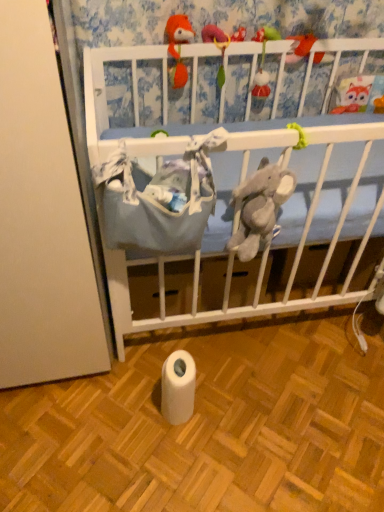
Identify the location of fuzzy fabric toy at upper center, marked as the second toy in a right-to-left arrangement. (263, 65).

The width and height of the screenshot is (384, 512). Find the location of `matte orange plush at upper center, which is the third toy in left-to-right order`. matte orange plush at upper center, which is the third toy in left-to-right order is located at coordinates (300, 47).

Where is `blue fabric crib at upper center`? The image size is (384, 512). blue fabric crib at upper center is located at coordinates point(105,91).

I want to click on white matte toilet paper at lower center, so click(178, 387).

You are a GUI agent. You are given a task and a screenshot of the screen. Output one action in this format:
    pyautogui.click(x=<x>, y=<y>)
    Task: Click on the fuzzy fabric toy at upper center, marked as the second toy in a right-to-left arrangement
    The height and width of the screenshot is (512, 384).
    Given the screenshot: What is the action you would take?
    pyautogui.click(x=263, y=65)

From the image's perspective, is white matte toilet paper at lower center beneath blue fabric crib at upper center?

Correct, white matte toilet paper at lower center appears lower than blue fabric crib at upper center in the image.

Is point (167, 368) in front of point (269, 53)?

Yes, point (167, 368) is in front of point (269, 53).

Is white matte toilet paper at lower center not within blue fabric crib at upper center?

white matte toilet paper at lower center lies outside blue fabric crib at upper center's area.

Consider the image. Is white matte toilet paper at lower center to the left or to the right of blue fabric crib at upper center in the image?

white matte toilet paper at lower center is positioned on blue fabric crib at upper center's left side.

Does matte orange plush at upper center, placed as the 1th toy when sorted from right to left, have a greater width compared to white matte toilet paper at lower center?

In fact, matte orange plush at upper center, placed as the 1th toy when sorted from right to left, might be narrower than white matte toilet paper at lower center.

Find the location of a particular element. toy that is the 3rd object located above the white matte toilet paper at lower center (from the image's perspective) is located at coordinates (300, 47).

Based on their positions, is matte orange plush at upper center, placed as the 1th toy when sorted from right to left, located to the left or right of white matte toilet paper at lower center?

matte orange plush at upper center, placed as the 1th toy when sorted from right to left, is positioned on white matte toilet paper at lower center's right side.

Is matte orange plush at upper center, which is the third toy in left-to-right order, not inside white matte toilet paper at lower center?

Yes, matte orange plush at upper center, which is the third toy in left-to-right order, is not within white matte toilet paper at lower center.

Is matte orange plush at upper center, which is the third toy in left-to-right order, facing away from fuzzy fabric toy at upper center, marked as the second toy in a right-to-left arrangement?

No, matte orange plush at upper center, which is the third toy in left-to-right order,'s orientation is not away from fuzzy fabric toy at upper center, marked as the second toy in a right-to-left arrangement.

Does matte orange plush at upper center, which is the third toy in left-to-right order, have a larger size compared to fuzzy fabric toy at upper center, marked as the second toy in a right-to-left arrangement?

Actually, matte orange plush at upper center, which is the third toy in left-to-right order, might be smaller than fuzzy fabric toy at upper center, marked as the second toy in a right-to-left arrangement.

Between matte orange plush at upper center, placed as the 1th toy when sorted from right to left, and fuzzy fabric toy at upper center, marked as the second toy in a right-to-left arrangement, which one has smaller width?

fuzzy fabric toy at upper center, marked as the second toy in a right-to-left arrangement, is thinner.

Is point (291, 38) closer or farther from the camera than point (270, 90)?

Point (291, 38).

From the image's perspective, is fluffy orange fox at upper center, the 1th toy from the left, below fuzzy fabric toy at upper center, marked as the second toy in a right-to-left arrangement?

Yes, from the image's perspective, fluffy orange fox at upper center, the 1th toy from the left, is beneath fuzzy fabric toy at upper center, marked as the second toy in a right-to-left arrangement.

How distant is fluffy orange fox at upper center, which ranks as the third toy in right-to-left order, from fuzzy fabric toy at upper center, marked as the second toy in a right-to-left arrangement?

fluffy orange fox at upper center, which ranks as the third toy in right-to-left order, is 9.75 inches away from fuzzy fabric toy at upper center, marked as the second toy in a right-to-left arrangement.

Can you confirm if fluffy orange fox at upper center, the 1th toy from the left, is bigger than fuzzy fabric toy at upper center, marked as the second toy in a right-to-left arrangement?

Incorrect, fluffy orange fox at upper center, the 1th toy from the left, is not larger than fuzzy fabric toy at upper center, marked as the second toy in a right-to-left arrangement.

Considering the relative positions of fluffy orange fox at upper center, the 1th toy from the left, and fuzzy fabric toy at upper center, marked as the 2th toy in a left-to-right arrangement, in the image provided, is fluffy orange fox at upper center, the 1th toy from the left, to the left or to the right of fuzzy fabric toy at upper center, marked as the 2th toy in a left-to-right arrangement,?

fluffy orange fox at upper center, the 1th toy from the left, is to the left of fuzzy fabric toy at upper center, marked as the 2th toy in a left-to-right arrangement.

Is fuzzy fabric toy at upper center, marked as the second toy in a right-to-left arrangement, directly adjacent to blue fabric crib at upper center?

fuzzy fabric toy at upper center, marked as the second toy in a right-to-left arrangement, is not next to blue fabric crib at upper center, and they're not touching.

From a real-world perspective, relative to blue fabric crib at upper center, is fuzzy fabric toy at upper center, marked as the 2th toy in a left-to-right arrangement, vertically above or below?

In terms of real-world spatial position, fuzzy fabric toy at upper center, marked as the 2th toy in a left-to-right arrangement, is above blue fabric crib at upper center.

Considering the relative positions of fuzzy fabric toy at upper center, marked as the 2th toy in a left-to-right arrangement, and blue fabric crib at upper center in the image provided, is fuzzy fabric toy at upper center, marked as the 2th toy in a left-to-right arrangement, to the left or to the right of blue fabric crib at upper center?

In the image, fuzzy fabric toy at upper center, marked as the 2th toy in a left-to-right arrangement, appears on the right side of blue fabric crib at upper center.

Could you tell me if fuzzy fabric toy at upper center, marked as the 2th toy in a left-to-right arrangement, is turned towards blue fabric crib at upper center?

No, fuzzy fabric toy at upper center, marked as the 2th toy in a left-to-right arrangement, is not oriented towards blue fabric crib at upper center.

Would you say matte orange plush at upper center, which is the third toy in left-to-right order, is to the left or to the right of blue fabric crib at upper center in the picture?

matte orange plush at upper center, which is the third toy in left-to-right order, is positioned on blue fabric crib at upper center's right side.

Considering the points (298, 48) and (248, 42), which point is behind, point (298, 48) or point (248, 42)?

The point (298, 48) is farther from the camera.

Considering the relative sizes of matte orange plush at upper center, which is the third toy in left-to-right order, and blue fabric crib at upper center in the image provided, is matte orange plush at upper center, which is the third toy in left-to-right order, smaller than blue fabric crib at upper center?

Indeed, matte orange plush at upper center, which is the third toy in left-to-right order, has a smaller size compared to blue fabric crib at upper center.

Is matte orange plush at upper center, placed as the 1th toy when sorted from right to left, oriented away from blue fabric crib at upper center?

Correct, matte orange plush at upper center, placed as the 1th toy when sorted from right to left, is looking away from blue fabric crib at upper center.

Can you confirm if fuzzy fabric toy at upper center, marked as the 2th toy in a left-to-right arrangement, is taller than white matte toilet paper at lower center?

Indeed, fuzzy fabric toy at upper center, marked as the 2th toy in a left-to-right arrangement, has a greater height compared to white matte toilet paper at lower center.

Is the position of fuzzy fabric toy at upper center, marked as the 2th toy in a left-to-right arrangement, more distant than that of white matte toilet paper at lower center?

That is True.

Who is smaller, fuzzy fabric toy at upper center, marked as the 2th toy in a left-to-right arrangement, or white matte toilet paper at lower center?

fuzzy fabric toy at upper center, marked as the 2th toy in a left-to-right arrangement, is smaller.

I want to click on toilet paper on the left side of blue fabric crib at upper center, so click(178, 387).

This screenshot has width=384, height=512. In the image, there is a matte orange plush at upper center, which is the third toy in left-to-right order. Find the location of `toilet paper below it (from the image's perspective)`. toilet paper below it (from the image's perspective) is located at coordinates (178, 387).

Estimate the real-world distances between objects in this image. Which object is closer to blue fabric crib at upper center, matte orange plush at upper center, which is the third toy in left-to-right order, or fluffy orange fox at upper center, the 1th toy from the left?

Based on the image, fluffy orange fox at upper center, the 1th toy from the left, appears to be nearer to blue fabric crib at upper center.

Which object lies further to the anchor point matte orange plush at upper center, which is the third toy in left-to-right order, fuzzy fabric toy at upper center, marked as the 2th toy in a left-to-right arrangement, or white matte toilet paper at lower center?

white matte toilet paper at lower center lies further to matte orange plush at upper center, which is the third toy in left-to-right order, than the other object.

Estimate the real-world distances between objects in this image. Which object is closer to blue fabric crib at upper center, fuzzy fabric toy at upper center, marked as the 2th toy in a left-to-right arrangement, or fluffy orange fox at upper center, the 1th toy from the left?

Among the two, fluffy orange fox at upper center, the 1th toy from the left, is located nearer to blue fabric crib at upper center.

Which object lies further to the anchor point fluffy orange fox at upper center, which ranks as the third toy in right-to-left order, matte orange plush at upper center, which is the third toy in left-to-right order, or white matte toilet paper at lower center?

white matte toilet paper at lower center is positioned further to the anchor fluffy orange fox at upper center, which ranks as the third toy in right-to-left order.

When comparing their distances from white matte toilet paper at lower center, does blue fabric crib at upper center or fuzzy fabric toy at upper center, marked as the second toy in a right-to-left arrangement, seem further?

Among the two, fuzzy fabric toy at upper center, marked as the second toy in a right-to-left arrangement, is located further to white matte toilet paper at lower center.

Considering their positions, is white matte toilet paper at lower center positioned further to matte orange plush at upper center, placed as the 1th toy when sorted from right to left, than fuzzy fabric toy at upper center, marked as the 2th toy in a left-to-right arrangement?

Based on the image, white matte toilet paper at lower center appears to be further to matte orange plush at upper center, placed as the 1th toy when sorted from right to left.

When comparing their distances from blue fabric crib at upper center, does matte orange plush at upper center, placed as the 1th toy when sorted from right to left, or fuzzy fabric toy at upper center, marked as the second toy in a right-to-left arrangement, seem further?

The object further to blue fabric crib at upper center is matte orange plush at upper center, placed as the 1th toy when sorted from right to left.

Looking at the image, which one is located closer to white matte toilet paper at lower center, fluffy orange fox at upper center, the 1th toy from the left, or blue fabric crib at upper center?

blue fabric crib at upper center is positioned closer to the anchor white matte toilet paper at lower center.

Locate an element on the screen. This screenshot has height=512, width=384. infant bed situated between fluffy orange fox at upper center, which ranks as the third toy in right-to-left order, and matte orange plush at upper center, placed as the 1th toy when sorted from right to left, from left to right is located at coordinates (105, 91).

Identify the location of toy between fuzzy fabric toy at upper center, marked as the second toy in a right-to-left arrangement, and white matte toilet paper at lower center in the up-down direction. (178, 47).

The image size is (384, 512). What are the coordinates of `infant bed between fluffy orange fox at upper center, which ranks as the third toy in right-to-left order, and fuzzy fabric toy at upper center, marked as the 2th toy in a left-to-right arrangement` in the screenshot? It's located at (105, 91).

At what (x,y) coordinates should I click in order to perform the action: click on toy between fluffy orange fox at upper center, which ranks as the third toy in right-to-left order, and matte orange plush at upper center, placed as the 1th toy when sorted from right to left, in the horizontal direction. Please return your answer as a coordinate pair (x, y). The image size is (384, 512). Looking at the image, I should click on (263, 65).